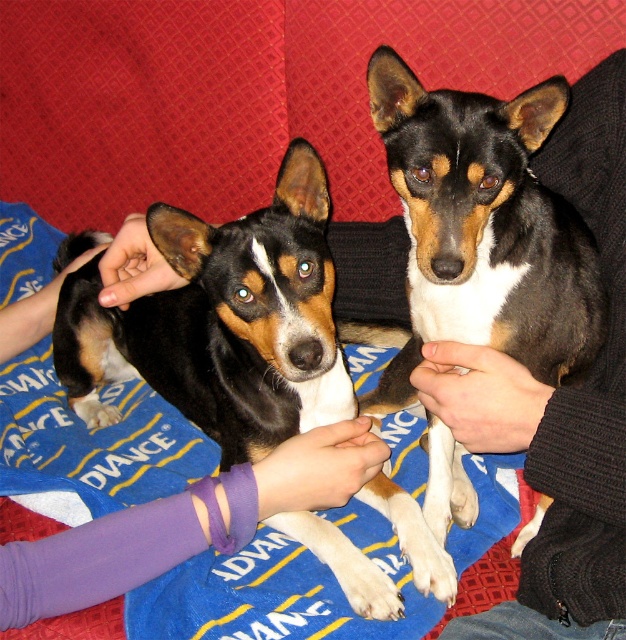
Who is more forward, [120,419] or [608,410]?

Point [608,410] is more forward.

Image resolution: width=626 pixels, height=640 pixels. Describe the element at coordinates (222, 323) in the screenshot. I see `black glossy dog at center` at that location.

Identify the location of black glossy dog at center. The width and height of the screenshot is (626, 640). (222, 323).

From the picture: Which is above, black and tan fur at center or purple fabric wristband at lower left?

black and tan fur at center

In the scene shown: Which of these two, black and tan fur at center or purple fabric wristband at lower left, stands shorter?

Standing shorter between the two is purple fabric wristband at lower left.

Between point (490, 241) and point (285, 467), which one is positioned behind?

The point (285, 467) is more distant.

Identify the location of black and tan fur at center. The width and height of the screenshot is (626, 640). (483, 228).

Who is more distant from viewer, (337, 410) or (444, 332)?

Positioned behind is point (337, 410).

Where is `black glossy dog at center`? The height and width of the screenshot is (640, 626). black glossy dog at center is located at coordinates (222, 323).

Locate an element on the screen. Image resolution: width=626 pixels, height=640 pixels. black glossy dog at center is located at coordinates (222, 323).